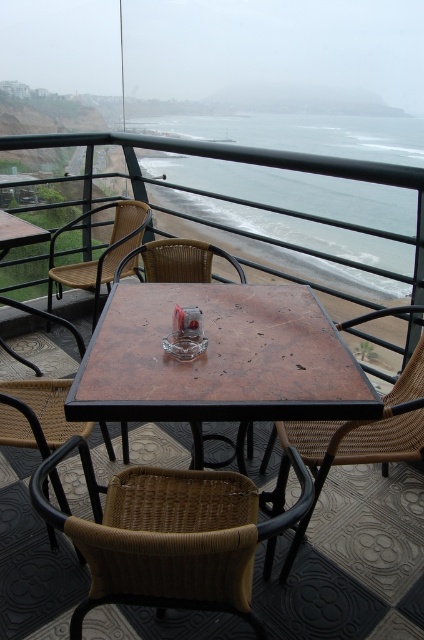
Question: Is woven brown chair at center below woven rattan chair at lower left?

Choices:
 (A) no
 (B) yes

Answer: (B)

Question: Estimate the real-world distances between objects in this image. Which object is farther from the brown marble table at center?

Choices:
 (A) woven rattan chair at lower left
 (B) woven brown chair at center
 (C) woven wood chair at center
 (D) woven rattan chair at center

Answer: (D)

Question: Which point is farther to the camera?

Choices:
 (A) (407, 372)
 (B) (89, 268)
 (C) (172, 273)

Answer: (B)

Question: Does woven brown chair at center appear on the left side of woven rattan chair at center?

Choices:
 (A) no
 (B) yes

Answer: (A)

Question: Which point is farther from the camera taking this photo?

Choices:
 (A) (217, 182)
 (B) (89, 408)
 (C) (237, 500)
 (D) (83, 218)

Answer: (A)

Question: Does brown marble table at center come behind woven wood chair at center?

Choices:
 (A) yes
 (B) no

Answer: (B)